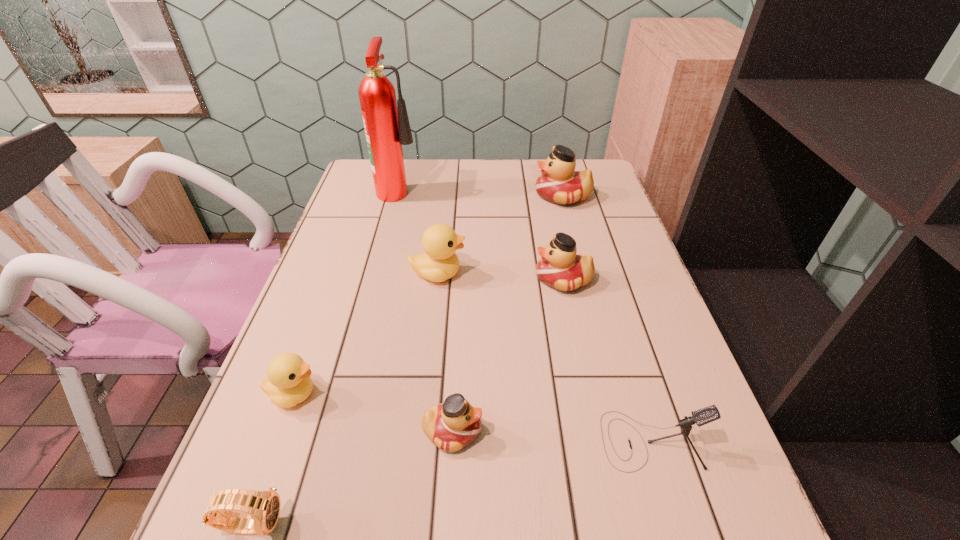
Find the location of a particular element. The width and height of the screenshot is (960, 540). fire extinguisher is located at coordinates (387, 128).

Where is `the tallest object`? The image size is (960, 540). the tallest object is located at coordinates (387, 128).

Where is `the farthest red duck`? the farthest red duck is located at coordinates 559,183.

At what (x,y) coordinates should I click in order to perform the action: click on the biggest red duck. Please return your answer as a coordinate pair (x, y). Looking at the image, I should click on (559, 183).

The width and height of the screenshot is (960, 540). Identify the location of the bigger yellow duck. (440, 262).

Where is `the right yellow duck`? This screenshot has width=960, height=540. the right yellow duck is located at coordinates (440, 262).

Locate an element on the screen. The width and height of the screenshot is (960, 540). the second biggest red duck is located at coordinates (560, 268).

I want to click on the left yellow duck, so click(289, 383).

The width and height of the screenshot is (960, 540). I want to click on the leftmost duck, so click(x=289, y=383).

Identify the location of microphone. (703, 416).